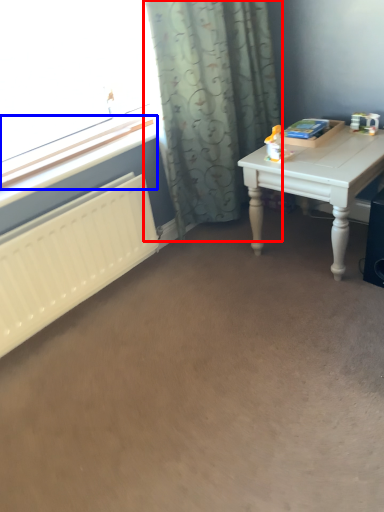
Question: Which of the following is the closest to the observer, curtain (highlighted by a red box) or window sill (highlighted by a blue box)?

Choices:
 (A) curtain
 (B) window sill

Answer: (A)